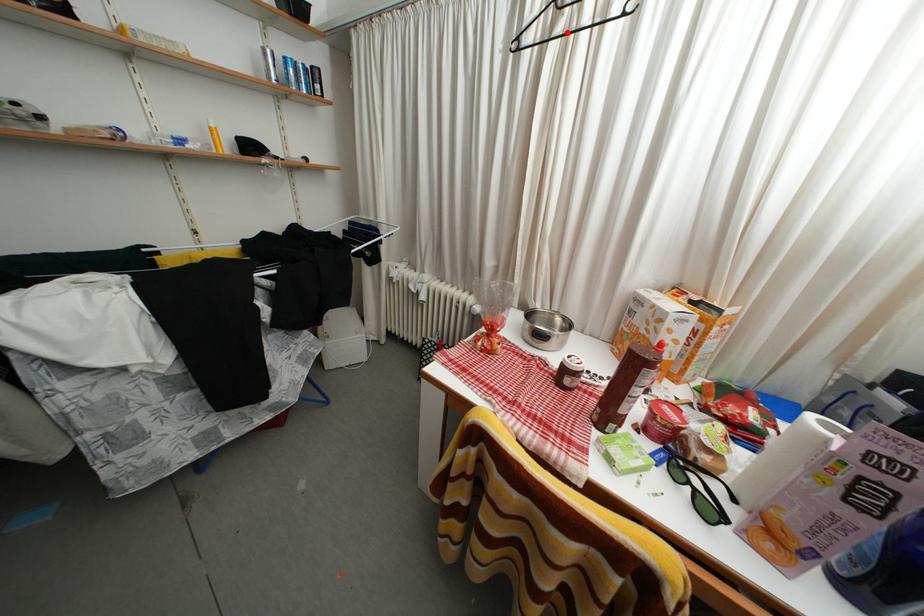
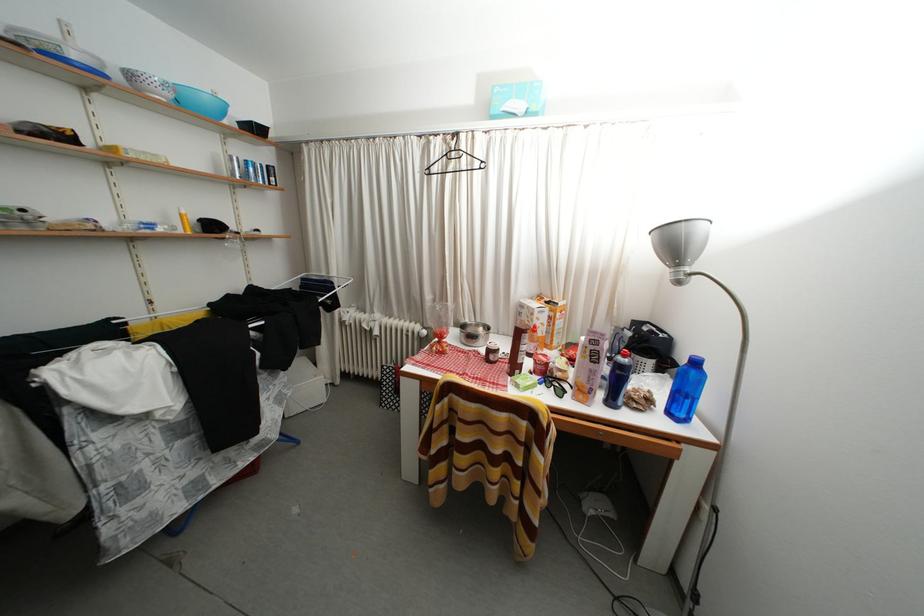
Locate, in the second image, the point that corresponds to the highlighted location in the first image.

(458, 172)